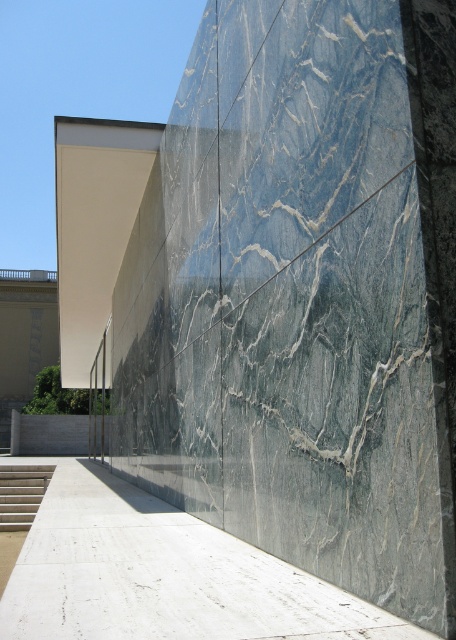
Question: From the image, what is the correct spatial relationship of white polished concrete at lower center in relation to white concrete stairs at lower left?

Choices:
 (A) below
 (B) above

Answer: (B)

Question: Can you confirm if white polished concrete at lower center is thinner than white concrete stairs at lower left?

Choices:
 (A) no
 (B) yes

Answer: (A)

Question: Which object is farther from the camera taking this photo?

Choices:
 (A) white polished concrete at lower center
 (B) white concrete stairs at lower left

Answer: (B)

Question: Is white polished concrete at lower center in front of white concrete stairs at lower left?

Choices:
 (A) yes
 (B) no

Answer: (A)